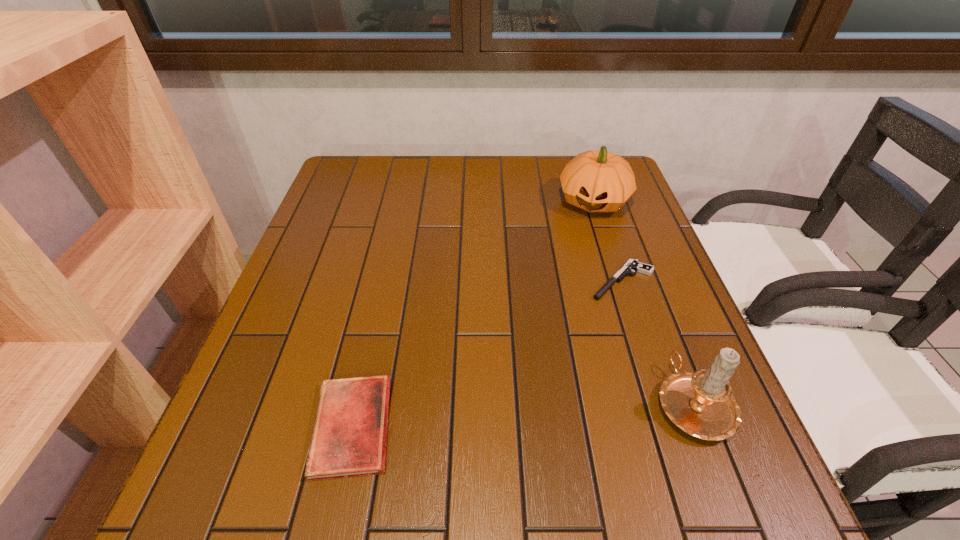
Locate which object ranks in proximity to the gourd. Please provide its 2D coordinates. Your answer should be formatted as a tuple, i.e. [(x, y)], where the tuple contains the x and y coordinates of a point satisfying the conditions above.

[(633, 265)]

Identify the location of object that ranks as the closest to the candle. (633, 265).

You are a GUI agent. You are given a task and a screenshot of the screen. Output one action in this format:
    pyautogui.click(x=<x>, y=<y>)
    Task: Click on the vacant area that satisfies the following two spatial constraints: 1. on the front side of the farthest object; 2. on the right side of the candle
    
    Given the screenshot: What is the action you would take?
    click(659, 403)

At what (x,y) coordinates should I click in order to perform the action: click on vacant space that satisfies the following two spatial constraints: 1. on the front side of the candle; 2. on the left side of the gourd. Please return your answer as a coordinate pair (x, y). This screenshot has width=960, height=540. Looking at the image, I should click on (659, 403).

I want to click on free spot that satisfies the following two spatial constraints: 1. on the front side of the farthest object; 2. on the right side of the candle, so click(x=659, y=403).